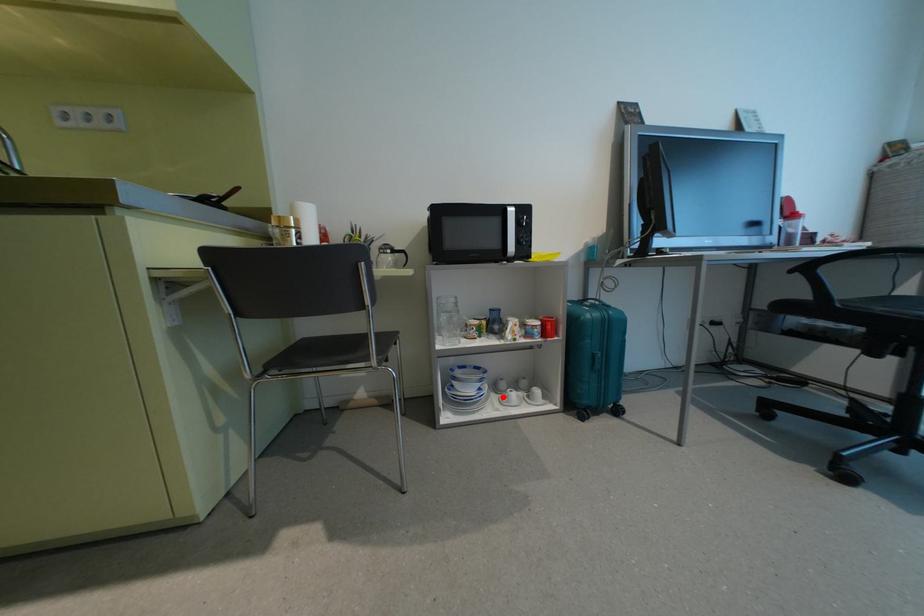
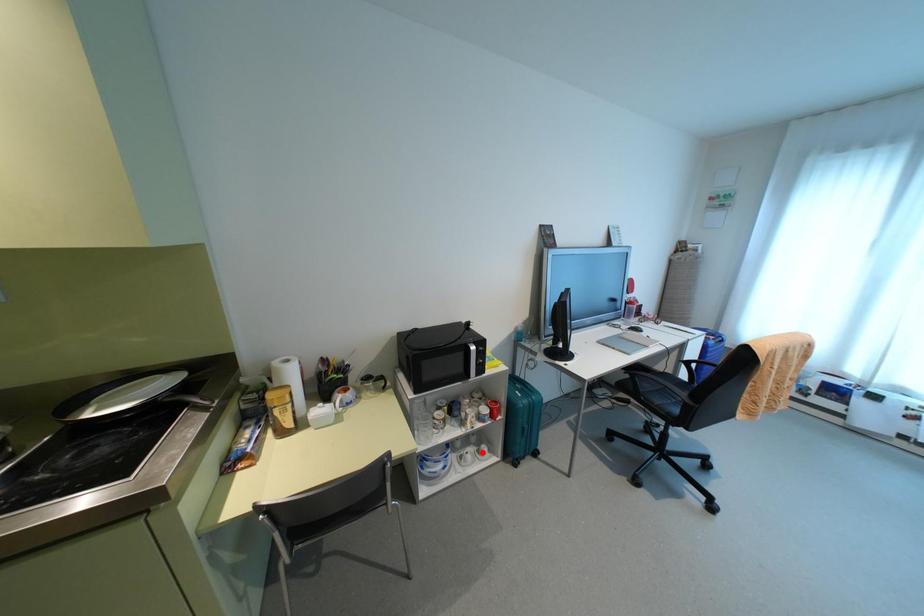
I am providing you with two images of the same scene from different viewpoints. A red point is marked on the first image and another point is marked on the second image. Do the highlighted points in image1 and image2 indicate the same real-world spot?

No